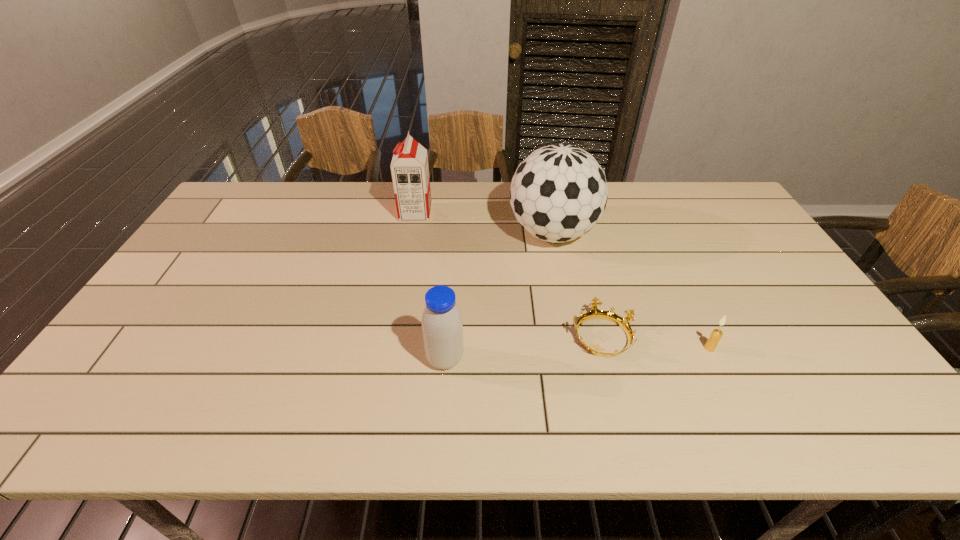
Locate an element on the screen. object that is the second closest to the shortest object is located at coordinates (558, 193).

Select which object appears as the second closest to the taller soya milk. Please provide its 2D coordinates. Your answer should be formatted as a tuple, i.e. [(x, y)], where the tuple contains the x and y coordinates of a point satisfying the conditions above.

[(442, 327)]

The height and width of the screenshot is (540, 960). I want to click on vacant space that satisfies the following two spatial constraints: 1. on the back side of the right soya milk; 2. on the right side of the candle, so click(x=445, y=348).

Image resolution: width=960 pixels, height=540 pixels. I want to click on vacant space that satisfies the following two spatial constraints: 1. on the front side of the candle; 2. on the right side of the farther soya milk, so click(391, 348).

At what (x,y) coordinates should I click in order to perform the action: click on vacant point that satisfies the following two spatial constraints: 1. on the back side of the shorter soya milk; 2. on the right side of the rightmost object. Please return your answer as a coordinate pair (x, y). The image size is (960, 540). Looking at the image, I should click on (445, 348).

In order to click on vacant region that satisfies the following two spatial constraints: 1. on the front side of the rightmost object; 2. on the left side of the shortest object in this screenshot , I will do click(605, 348).